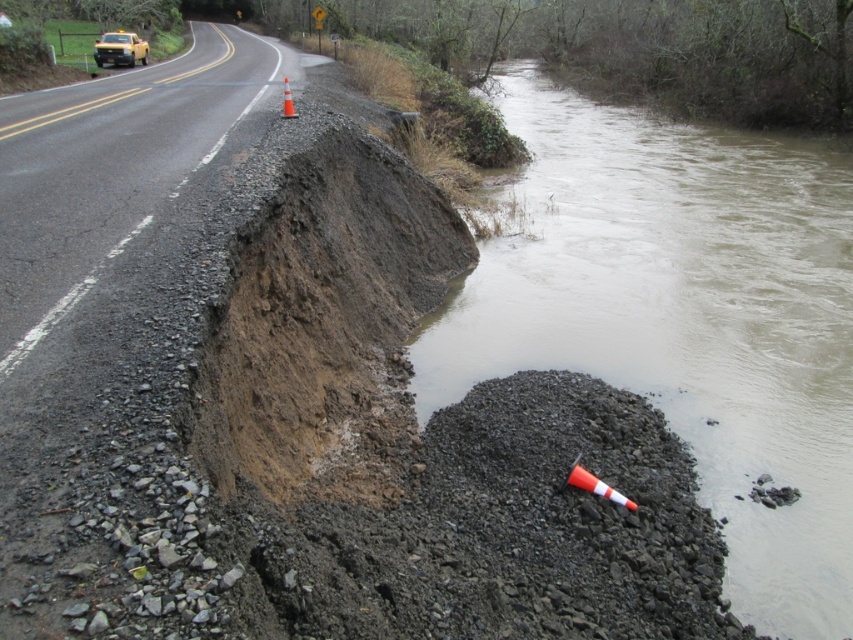
You are a surveyor standing at the edge of the road near the intact section. You need to measure the distance to the collapsed section of the road. The collapsed area is marked by point coordinates point (712, 384). Can you determine if this distance is more than 8 meters?

The distance between point (712, 384) and the viewer is 8.42 meters, so yes, the distance is more than 8 meters.

You are a driver approaching the damaged road. You see a yellow plastic car at upper left and an orange reflective cone at lower right. Which object is wider?

The yellow plastic car at upper left might be wider than orange reflective cone at lower right according to the description.

You are a driver approaching the flooded road and see the orange reflective cone at road center and the brown dirt at center. Which object is closer to the right side of the road?

The brown dirt at center is to the right of the orange reflective cone at road center, so the brown dirt at center is closer to the right side of the road.